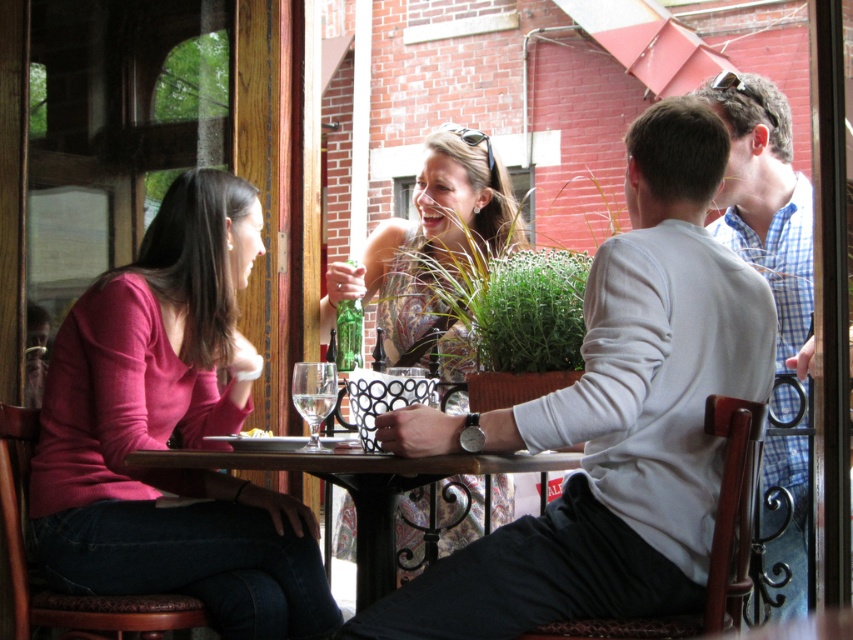
Looking at this image, you are a customer at the outdoor cafe and want to place a small plate between the light gray sweater at right and the yellow crumbly food at table center. Can you fit it there?

The light gray sweater at right is bigger than the yellow crumbly food at table center, but the exact distance between them isn

You are a customer at the outdoor cafe and want to grab the green glass bottle at center without disturbing the person in the matte pink sweater at left. Can you reach it from your current position?

The matte pink sweater at left is located below the green glass bottle at center, so the bottle is above the person. You can reach the green glass bottle at center without disturbing them by simply reaching upward.